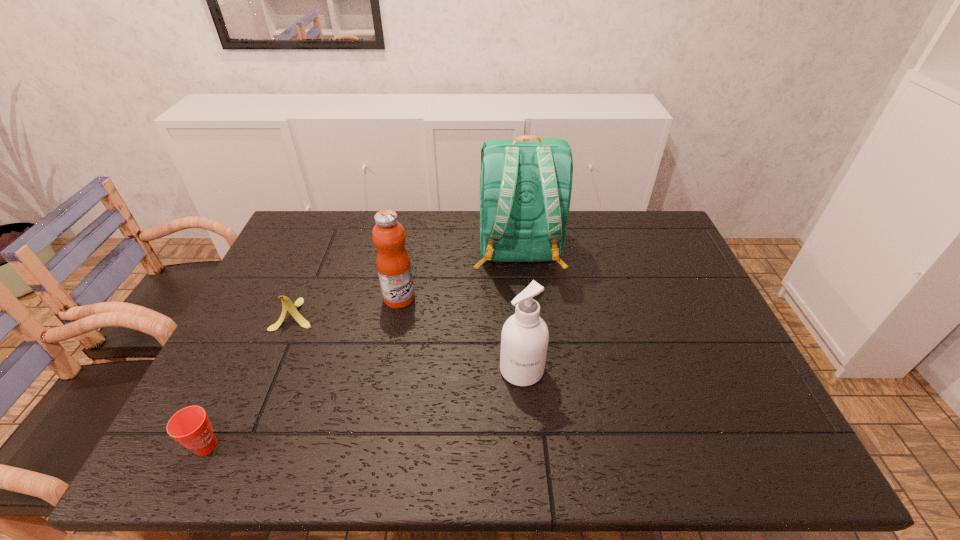
Where is `unoccupied position between the nearest object and the third object from left to right`? The height and width of the screenshot is (540, 960). unoccupied position between the nearest object and the third object from left to right is located at coordinates (302, 372).

The image size is (960, 540). Find the location of `vacant space that is in between the banana and the third object from right to left`. vacant space that is in between the banana and the third object from right to left is located at coordinates (348, 306).

The height and width of the screenshot is (540, 960). I want to click on free space between the third object from right to left and the banana, so click(x=348, y=306).

Identify which object is the nearest to the backpack. Please provide its 2D coordinates. Your answer should be formatted as a tuple, i.e. [(x, y)], where the tuple contains the x and y coordinates of a point satisfying the conditions above.

[(393, 263)]

Locate an element on the screen. The image size is (960, 540). object that is the second closest to the banana is located at coordinates (190, 426).